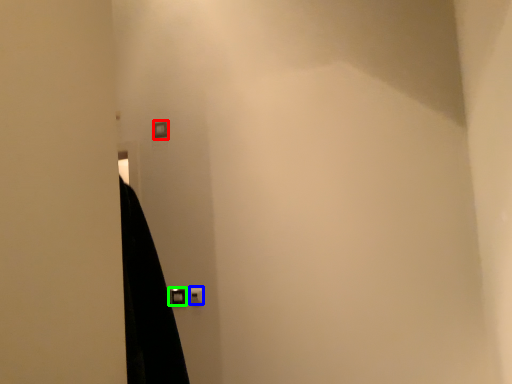
Question: Estimate the real-world distances between objects in this image. Which object is closer to light switch (highlighted by a red box), light switch (highlighted by a blue box) or door handle (highlighted by a green box)?

Choices:
 (A) light switch
 (B) door handle

Answer: (B)